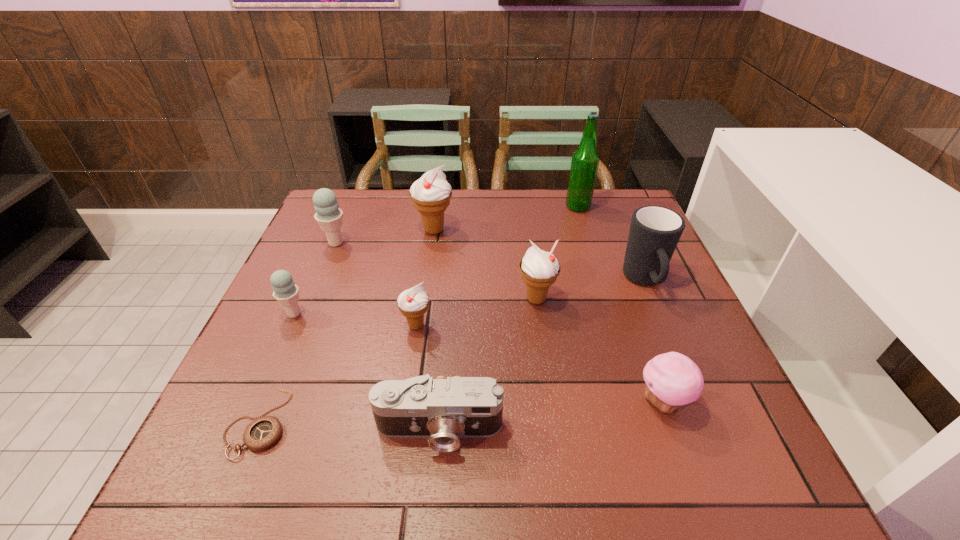
What are the coordinates of `the fifth closest icecream to the cupcake` in the screenshot? It's located at (329, 216).

Point out which icecream is positioned as the fourth nearest to the cupcake. Please provide its 2D coordinates. Your answer should be formatted as a tuple, i.e. [(x, y)], where the tuple contains the x and y coordinates of a point satisfying the conditions above.

[(285, 291)]

The image size is (960, 540). In order to click on white icecream that is the second closest to the tallest object in this screenshot , I will do `click(431, 194)`.

The height and width of the screenshot is (540, 960). Identify the location of white icecream that is the nearest to the cupcake. (539, 270).